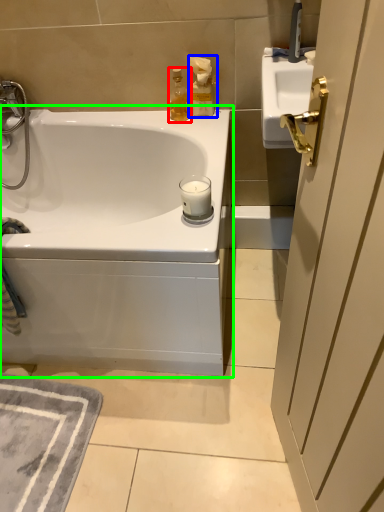
Question: Based on their relative distances, which object is nearer to soap dispenser (highlighted by a red box)? Choose from bottle (highlighted by a blue box) and bathtub (highlighted by a green box).

Choices:
 (A) bottle
 (B) bathtub

Answer: (A)